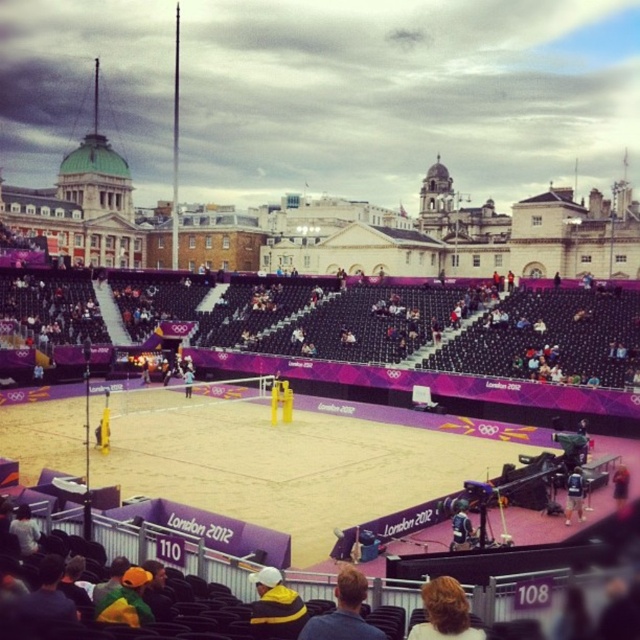
Who is positioned more to the right, sand at center or blue backpack at lower right?

From the viewer's perspective, blue backpack at lower right appears more on the right side.

Is point (576, 216) behind point (580, 500)?

Yes, it is.

Between point (58, 202) and point (573, 480), which one is positioned behind?

Point (58, 202)

Where is `sand at center`? This screenshot has height=640, width=640. sand at center is located at coordinates click(420, 236).

Which is behind, point (125, 612) or point (621, 481)?

Point (621, 481)

Who is taller, velvet yellow jacket at lower left or light brown leather jacket at lower right?

velvet yellow jacket at lower left

Locate an element on the screen. The height and width of the screenshot is (640, 640). velvet yellow jacket at lower left is located at coordinates (125, 600).

Where is `velvet yellow jacket at lower left`? This screenshot has height=640, width=640. velvet yellow jacket at lower left is located at coordinates (125, 600).

Is blonde hair at lower center wider than yellow fabric person at center?

Correct, the width of blonde hair at lower center exceeds that of yellow fabric person at center.

Between blonde hair at lower center and yellow fabric person at center, which one appears on the right side from the viewer's perspective?

From the viewer's perspective, blonde hair at lower center appears more on the right side.

What do you see at coordinates (444, 612) in the screenshot?
I see `blonde hair at lower center` at bounding box center [444, 612].

Locate an element on the screen. blonde hair at lower center is located at coordinates (444, 612).